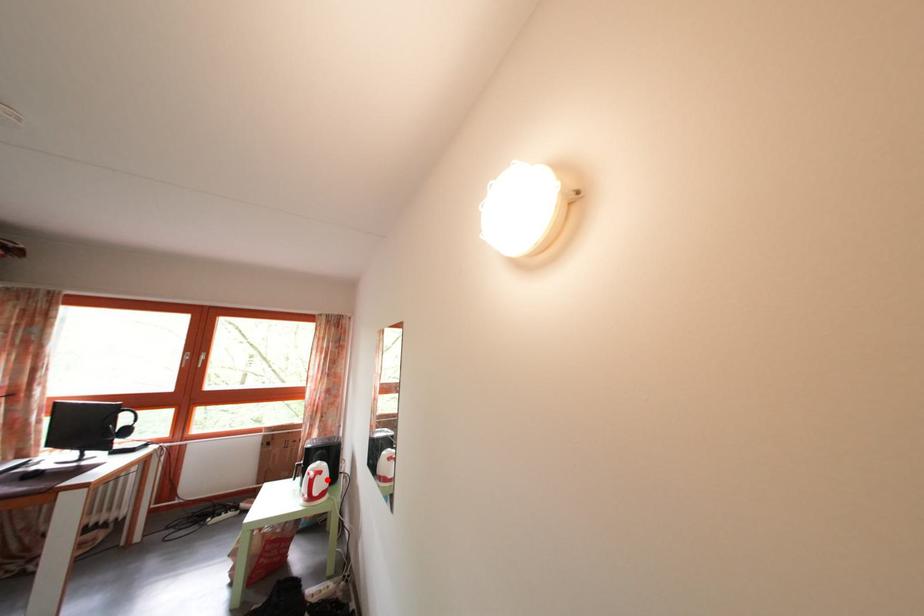
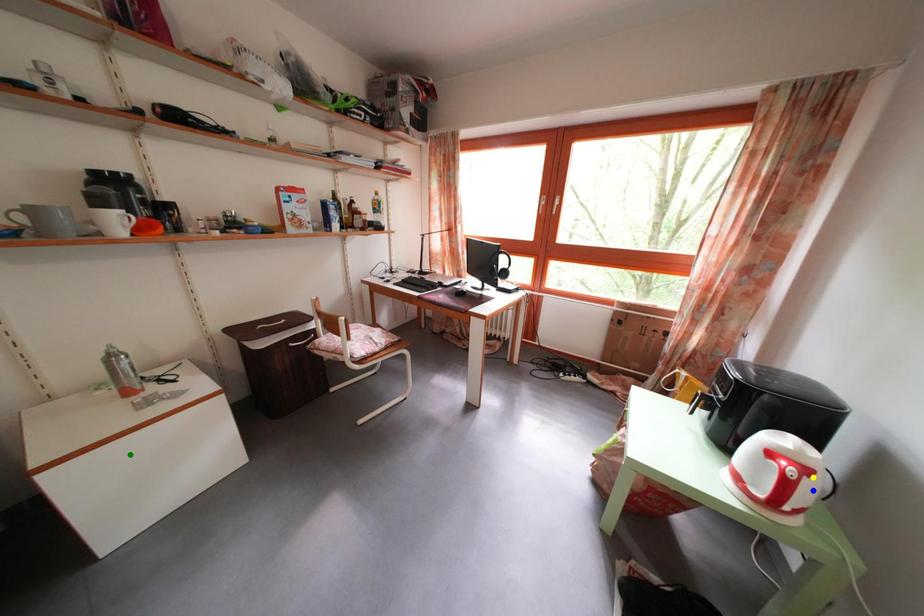
Question: I am providing you with two images of the same scene from different viewpoints. A red point is marked on the first image. You are given multiple points on the second image. Which spot in image 2 lines up with the point in image 1?

Choices:
 (A) yellow point
 (B) green point
 (C) blue point

Answer: (A)